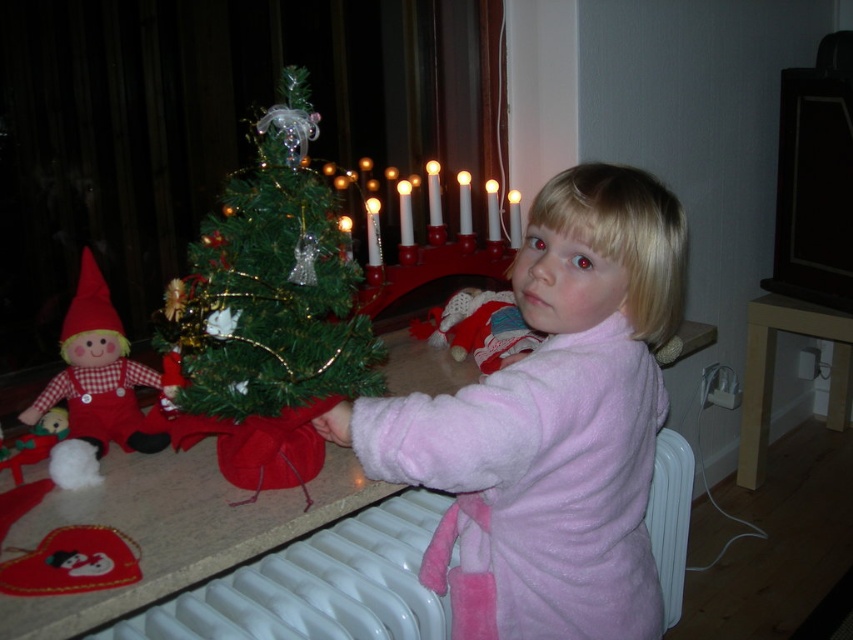
You are trying to place a new decorative item in the room. The item is 2 feet wide. You want to place it on the floor between the white plastic radiator at lower center and the red plaid fabric doll at left. Is there enough space between them for the item?

The white plastic radiator at lower center might be wider than the red plaid fabric doll at left, so there may not be enough space between them for the 2 feet wide item. Check the actual width before placing it.

You are a photographer standing in the room and want to capture a closeup shot of the pink fuzzy pajamas at center. Given that your camera has a minimum focusing distance of 30 inches, will you be able to take the photo without moving closer?

The pink fuzzy pajamas at center is 33.16 inches from camera, which is beyond the camera minimum focusing distance of 30 inches. Therefore, you can take the photo without moving closer.

You are a parent checking the safety of your home. You see the white plastic radiator at lower center and the red plaid fabric doll at left. Which object is shorter and needs to be placed out of the child reach?

The white plastic radiator at lower center is shorter than the red plaid fabric doll at left. Since it is shorter, the white plastic radiator at lower center should be placed out of the child reach to prevent accidental touching.